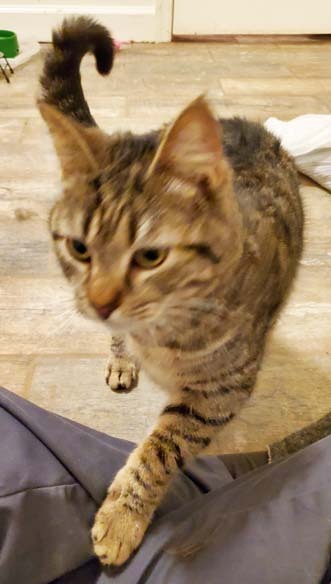
I want to click on green bowl, so click(x=9, y=41).